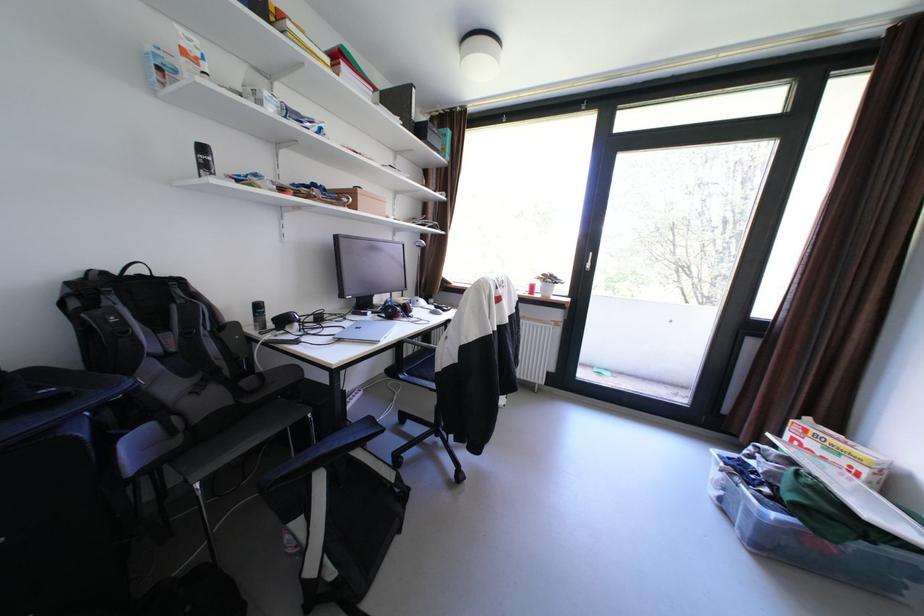
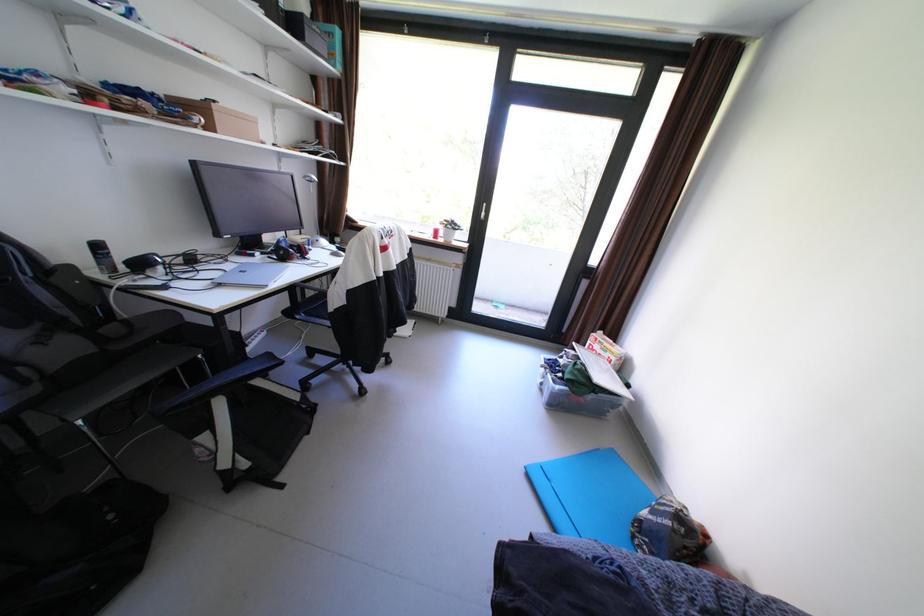
Where in the second image is the point corresponding to point (411, 377) from the first image?

(309, 317)